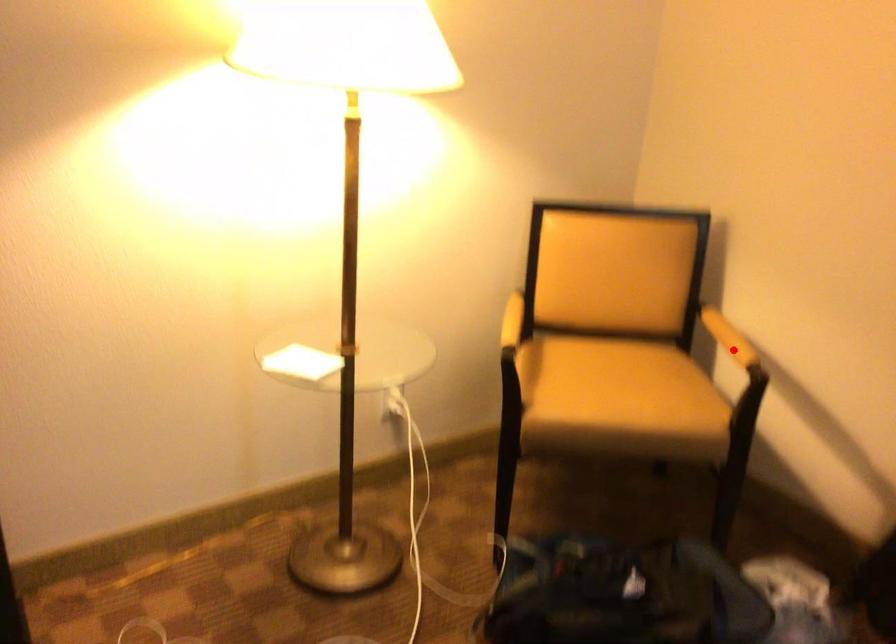
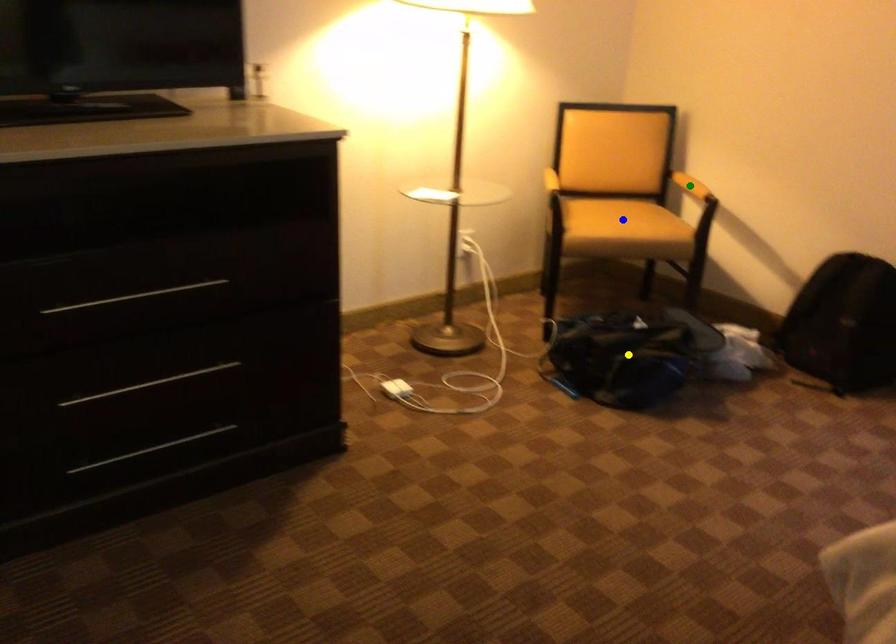
Question: I am providing you with two images of the same scene from different viewpoints. A red point is marked on the first image. You are given multiple points on the second image. Can you choose the point in image 2 that corresponds to the point in image 1?

Choices:
 (A) green point
 (B) blue point
 (C) yellow point

Answer: (A)